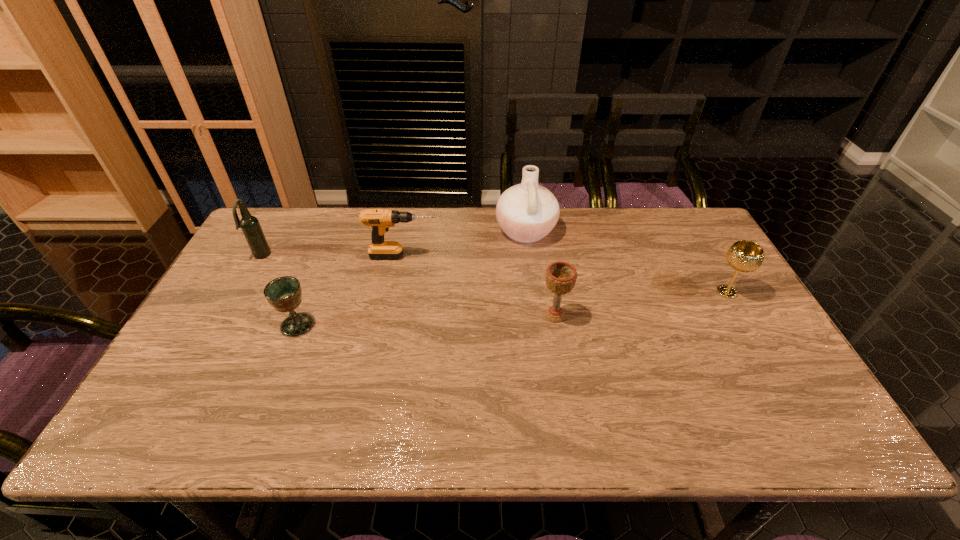
This screenshot has height=540, width=960. In order to click on free space between the second chalice from right to left and the third object from left to right in this screenshot , I will do `click(479, 286)`.

This screenshot has height=540, width=960. I want to click on empty space between the second chalice from right to left and the drill, so click(x=479, y=286).

Find the location of a particular element. This screenshot has height=540, width=960. free point between the pottery and the second chalice from left to right is located at coordinates (540, 273).

Locate an element on the screen. The image size is (960, 540). free area in between the pottery and the drill is located at coordinates (465, 244).

Identify which object is located as the fourth nearest to the leftmost object. Please provide its 2D coordinates. Your answer should be formatted as a tuple, i.e. [(x, y)], where the tuple contains the x and y coordinates of a point satisfying the conditions above.

[(561, 276)]

Select which object appears as the fifth closest to the pottery. Please provide its 2D coordinates. Your answer should be formatted as a tuple, i.e. [(x, y)], where the tuple contains the x and y coordinates of a point satisfying the conditions above.

[(251, 228)]

Point out which chalice is positioned as the nearest to the beer bottle. Please provide its 2D coordinates. Your answer should be formatted as a tuple, i.e. [(x, y)], where the tuple contains the x and y coordinates of a point satisfying the conditions above.

[(284, 293)]

Locate which chalice is the second closest to the fourth farthest object. Please provide its 2D coordinates. Your answer should be formatted as a tuple, i.e. [(x, y)], where the tuple contains the x and y coordinates of a point satisfying the conditions above.

[(284, 293)]

Image resolution: width=960 pixels, height=540 pixels. What are the coordinates of `blank area in the image that satisfies the following two spatial constraints: 1. to pour from the handle of the pottery; 2. on the front side of the leftmost object` in the screenshot? It's located at (529, 256).

Where is `free location that satisfies the following two spatial constraints: 1. at the tip of the second chalice from right to left; 2. on the left side of the drill`? free location that satisfies the following two spatial constraints: 1. at the tip of the second chalice from right to left; 2. on the left side of the drill is located at coordinates (392, 316).